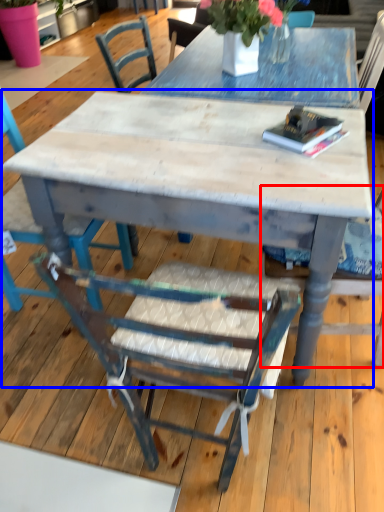
Question: Which object appears farthest to the camera in this image, chair (highlighted by a red box) or kitchen & dining room table (highlighted by a blue box)?

Choices:
 (A) chair
 (B) kitchen & dining room table

Answer: (B)